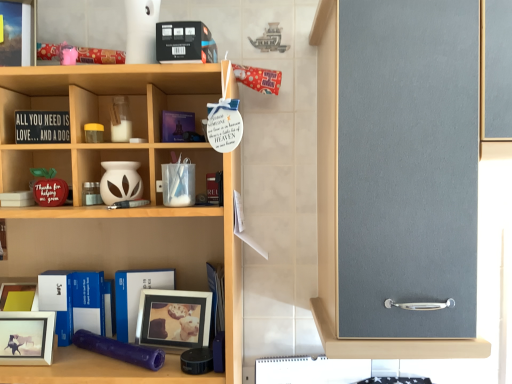
Question: Considering the positions of point (96, 294) and point (208, 271), is point (96, 294) closer or farther from the camera than point (208, 271)?

Choices:
 (A) closer
 (B) farther

Answer: (A)

Question: Looking at their shapes, would you say blue matte book at lower left, positioned as the 6th book in top-to-bottom order, is wider or thinner than blue hardcover book at center, which appears as the 4th book when viewed from the top?

Choices:
 (A) thin
 (B) wide

Answer: (B)

Question: Estimate the real-world distances between objects in this image. Which object is closer to the black matte book at upper center, the first book positioned from the top?

Choices:
 (A) white matte picture frame at lower left, the 1th picture frame from the front
 (B) matte purple book at center, the fourth book ordered from the bottom
 (C) wooden picture frame at lower center, which ranks as the 1th picture frame in back-to-front order
 (D) blue hardcover book at center, which is the fifth book from top to bottom
 (E) blue matte book at lower left, which ranks as the first book in bottom-to-top order

Answer: (B)

Question: Estimate the real-world distances between objects in this image. Which object is closer to the matte purple book at center, the fourth book ordered from the bottom?

Choices:
 (A) blue hardcover book at center, which appears as the 4th book when viewed from the top
 (B) blue hardcover book at center, placed as the 2th book when sorted from bottom to top
 (C) black matte book at upper center, the first book positioned from the top
 (D) matte black signboard at left, which appears as the 2th book when viewed from the top
 (E) blue matte book at lower left, positioned as the 6th book in top-to-bottom order

Answer: (C)